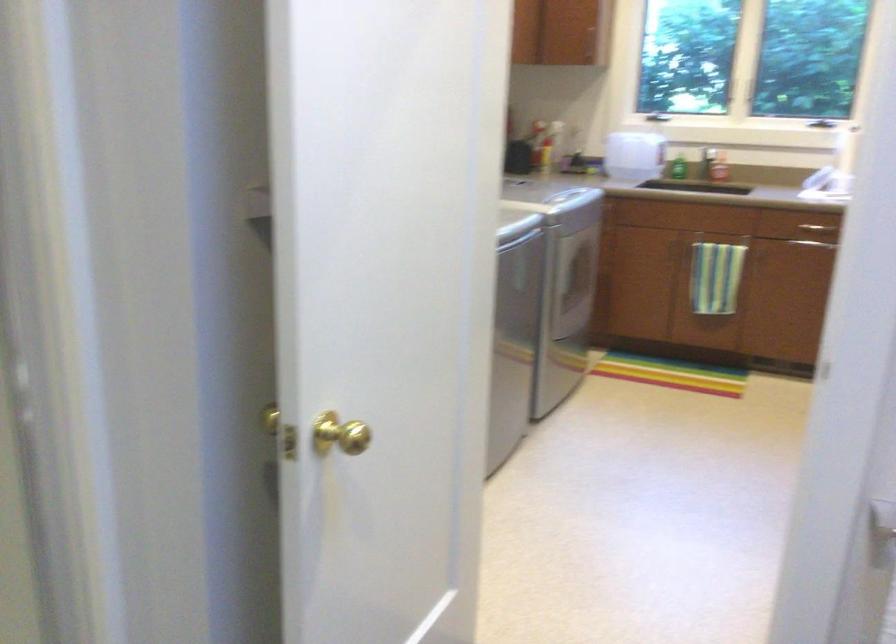
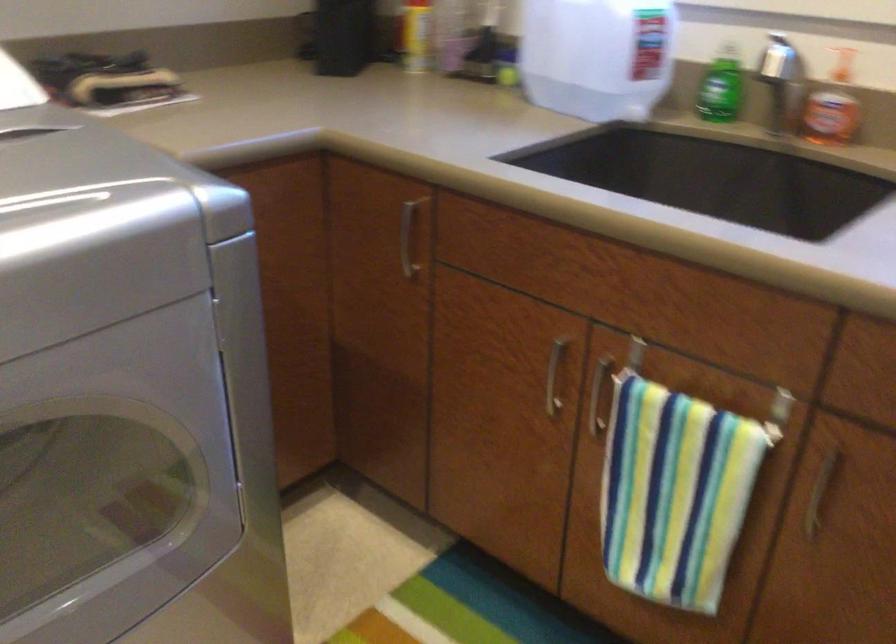
In the second image, find the point that corresponds to pixel 666 251 in the first image.

(554, 375)